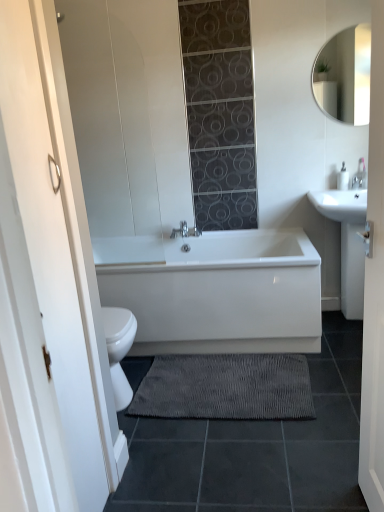
Question: From a real-world perspective, does white glossy mirror at upper right stand above white wooden door at center?

Choices:
 (A) yes
 (B) no

Answer: (A)

Question: Considering the relative sizes of white glossy mirror at upper right and white wooden door at center in the image provided, is white glossy mirror at upper right thinner than white wooden door at center?

Choices:
 (A) yes
 (B) no

Answer: (A)

Question: Is the surface of white glossy mirror at upper right in direct contact with white wooden door at center?

Choices:
 (A) yes
 (B) no

Answer: (B)

Question: Is white glossy mirror at upper right closer to camera compared to white wooden door at center?

Choices:
 (A) no
 (B) yes

Answer: (A)

Question: Can you confirm if white glossy mirror at upper right is bigger than white wooden door at center?

Choices:
 (A) no
 (B) yes

Answer: (A)

Question: In terms of size, does white glossy sink at right appear bigger or smaller than white matte glass door at left?

Choices:
 (A) small
 (B) big

Answer: (B)

Question: Considering the positions of white glossy sink at right and white matte glass door at left in the image, is white glossy sink at right taller or shorter than white matte glass door at left?

Choices:
 (A) short
 (B) tall

Answer: (A)

Question: Considering the positions of white glossy sink at right and white matte glass door at left in the image, is white glossy sink at right wider or thinner than white matte glass door at left?

Choices:
 (A) thin
 (B) wide

Answer: (B)

Question: Relative to white matte glass door at left, is white glossy sink at right in front or behind?

Choices:
 (A) front
 (B) behind

Answer: (B)

Question: In terms of size, does white wooden door at center appear bigger or smaller than white matte glass door at left?

Choices:
 (A) big
 (B) small

Answer: (A)

Question: Is white wooden door at center taller or shorter than white matte glass door at left?

Choices:
 (A) short
 (B) tall

Answer: (B)

Question: Which is correct: white wooden door at center is inside white matte glass door at left, or outside of it?

Choices:
 (A) inside
 (B) outside

Answer: (B)

Question: Considering the relative positions of white wooden door at center and white matte glass door at left in the image provided, is white wooden door at center to the left or to the right of white matte glass door at left?

Choices:
 (A) left
 (B) right

Answer: (B)

Question: From a real-world perspective, is gray textured bath mat at lower center above or below white matte glass door at left?

Choices:
 (A) below
 (B) above

Answer: (A)

Question: Considering the positions of gray textured bath mat at lower center and white matte glass door at left in the image, is gray textured bath mat at lower center taller or shorter than white matte glass door at left?

Choices:
 (A) short
 (B) tall

Answer: (A)